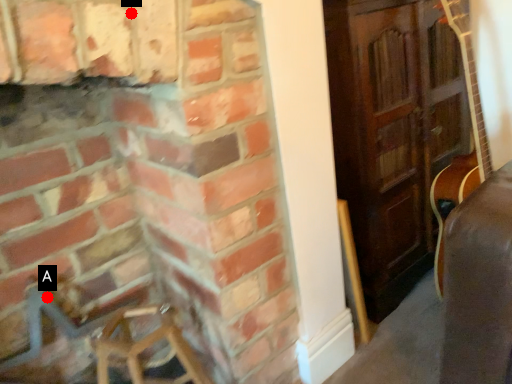
Question: Two points are circled on the image, labeled by A and B beside each circle. Which point is farther from the camera taking this photo?

Choices:
 (A) A is further
 (B) B is further

Answer: (A)